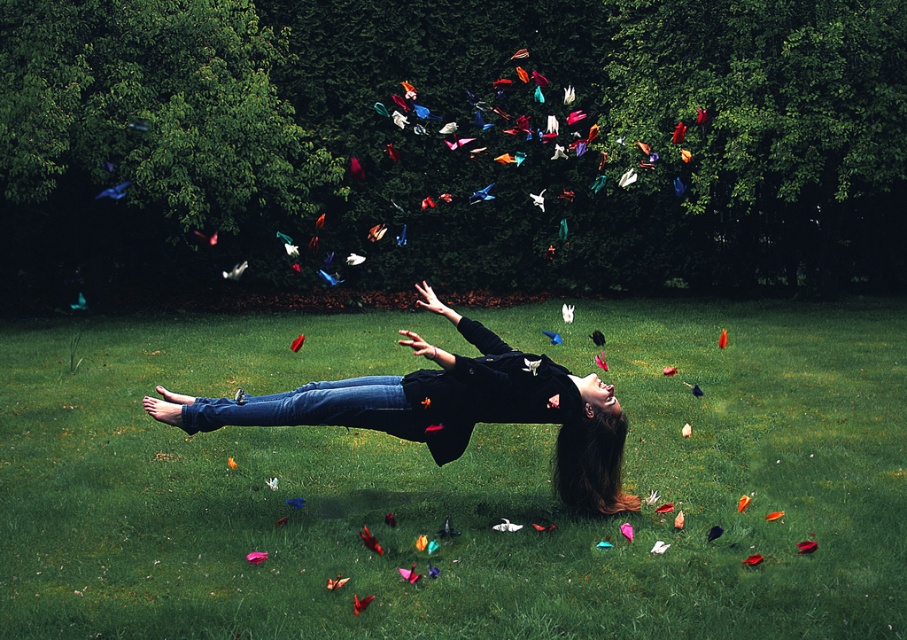
Which of these two, green grass at center or denim jeans at lower center, stands shorter?

denim jeans at lower center is shorter.

Based on the photo, can you confirm if green grass at center is wider than denim jeans at lower center?

Correct, the width of green grass at center exceeds that of denim jeans at lower center.

In order to click on green grass at center in this screenshot , I will do `click(457, 483)`.

The image size is (907, 640). Identify the location of green grass at center. (457, 483).

Can you confirm if matte black jacket at center is positioned to the right of denim jeans at lower center?

Correct, you'll find matte black jacket at center to the right of denim jeans at lower center.

Is matte black jacket at center above denim jeans at lower center?

Indeed, matte black jacket at center is positioned over denim jeans at lower center.

Does point (258, 410) come closer to viewer compared to point (350, 390)?

That is False.

This screenshot has height=640, width=907. I want to click on matte black jacket at center, so click(449, 406).

Can you confirm if green grass at center is smaller than matte black jacket at center?

No.

Between point (886, 444) and point (517, 349), which one is positioned in front?

Point (886, 444) is in front.

Who is more distant from viewer, (x=621, y=352) or (x=158, y=413)?

The point (x=621, y=352) is behind.

I want to click on green grass at center, so click(x=457, y=483).